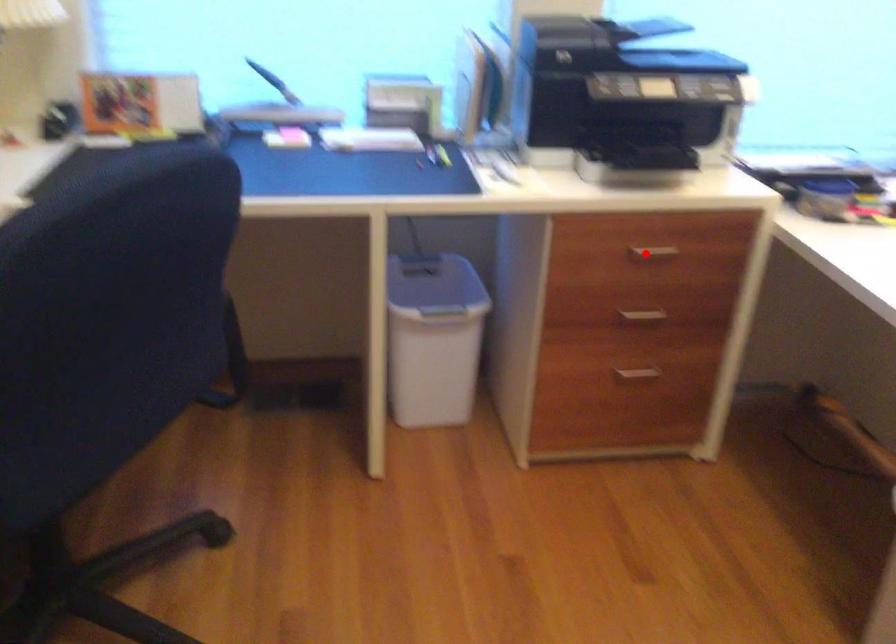
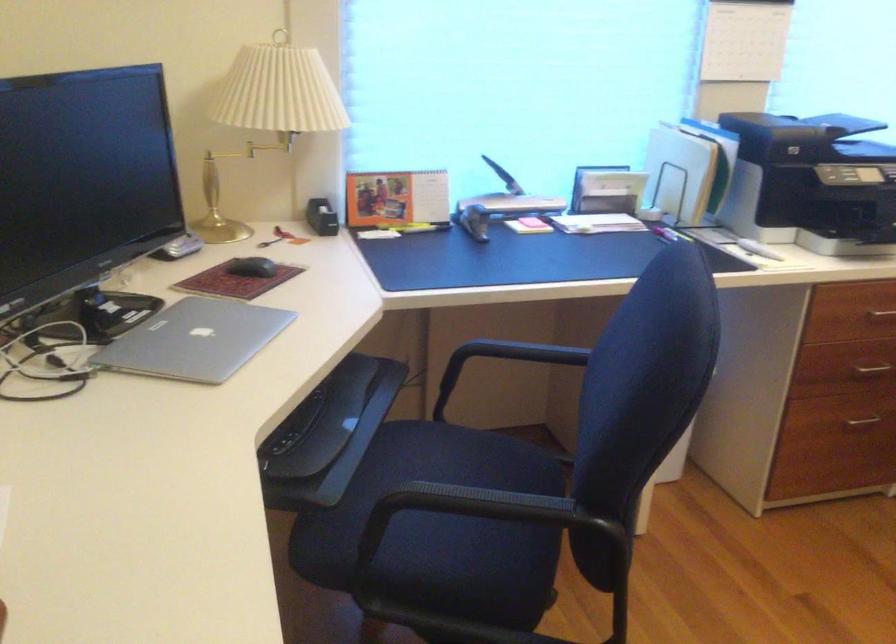
Question: I am providing you with two images of the same scene from different viewpoints. Given a red point in image1, look at the same physical point in image2. Is it:

Choices:
 (A) Closer to the viewpoint
 (B) Farther from the viewpoint

Answer: (B)